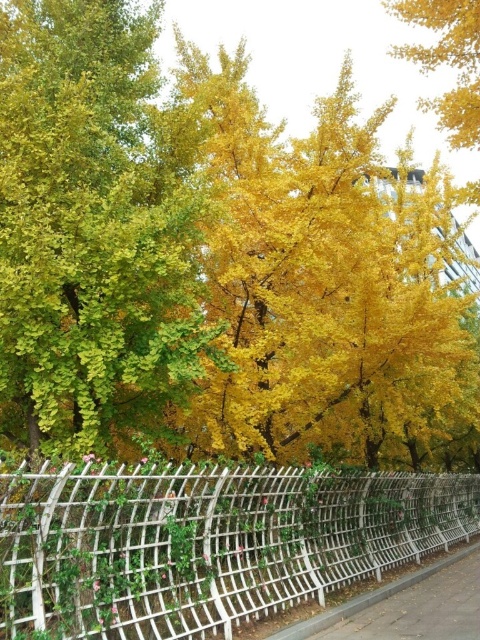
Is white lattice fence at center positioned at the back of gray concrete pavement at lower center?

No, it is in front of gray concrete pavement at lower center.

How distant is white lattice fence at center from gray concrete pavement at lower center?

white lattice fence at center is 4.15 meters away from gray concrete pavement at lower center.

Which is in front, point (269, 524) or point (464, 554)?

Positioned in front is point (269, 524).

Locate an element on the screen. white lattice fence at center is located at coordinates (206, 541).

The height and width of the screenshot is (640, 480). Describe the element at coordinates (93, 228) in the screenshot. I see `golden yellow leaves at center` at that location.

The height and width of the screenshot is (640, 480). Find the location of `golden yellow leaves at center`. golden yellow leaves at center is located at coordinates (93, 228).

You are a GUI agent. You are given a task and a screenshot of the screen. Output one action in this format:
    pyautogui.click(x=<x>, y=<y>)
    Task: Click on the golden yellow leaves at center
    The width and height of the screenshot is (480, 640).
    Given the screenshot: What is the action you would take?
    pyautogui.click(x=93, y=228)

At what (x,y) coordinates should I click in order to perform the action: click on golden yellow leaves at center. Please return your answer as a coordinate pair (x, y). The height and width of the screenshot is (640, 480). Looking at the image, I should click on (93, 228).

Does golden yellow leaves at center have a lesser height compared to white lattice fence at center?

Incorrect, golden yellow leaves at center's height does not fall short of white lattice fence at center's.

Who is more distant from viewer, (194, 282) or (139, 506)?

Positioned behind is point (194, 282).

Identify the location of golden yellow leaves at center. (93, 228).